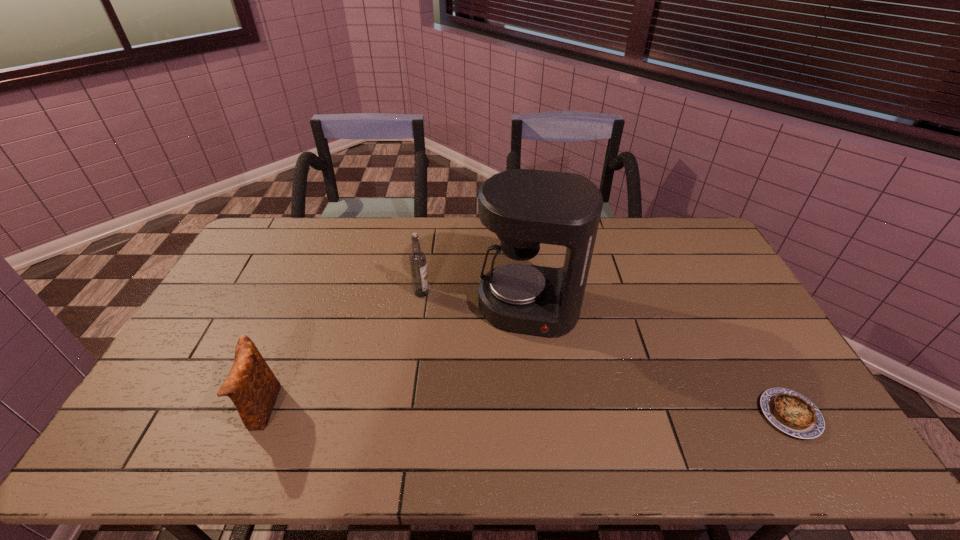
This screenshot has width=960, height=540. In order to click on free space located on the open side of the leftmost object in this screenshot , I will do `click(148, 409)`.

Where is `vacant position located on the left of the shortest object`? The width and height of the screenshot is (960, 540). vacant position located on the left of the shortest object is located at coordinates (741, 415).

This screenshot has height=540, width=960. In order to click on blank space located on the label of the second tallest object in this screenshot , I will do `click(435, 308)`.

Identify the location of vacant area situated 0.070m on the label of the second tallest object. The image size is (960, 540). (437, 310).

The image size is (960, 540). Identify the location of vacant area situated 0.250m on the label of the second tallest object. (469, 347).

In order to click on vacant space located on the button side of the tallest object in this screenshot , I will do `click(515, 394)`.

Image resolution: width=960 pixels, height=540 pixels. In order to click on vacant position located on the button side of the tallest object in this screenshot , I will do `click(519, 361)`.

The image size is (960, 540). Find the location of `vacant region located 0.210m on the button side of the tallest object`. vacant region located 0.210m on the button side of the tallest object is located at coordinates (514, 401).

Find the location of `clutch bag that is at the near edge`. clutch bag that is at the near edge is located at coordinates (251, 385).

Identify the location of quiche that is at the near edge. (792, 413).